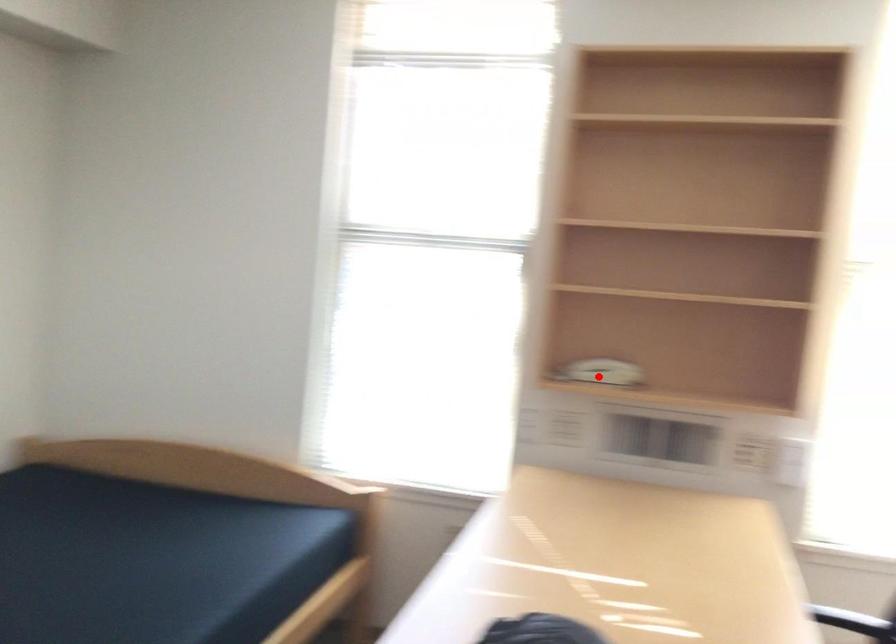
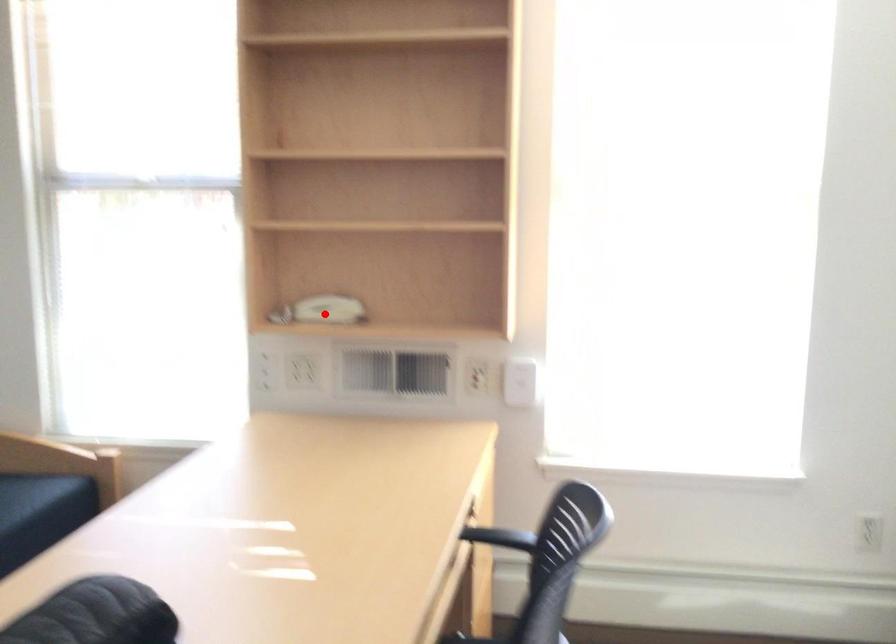
I am providing you with two images of the same scene from different viewpoints. A red point is marked on the first image and another point is marked on the second image. Is the red point in image1 aligned with the point shown in image2?

Yes